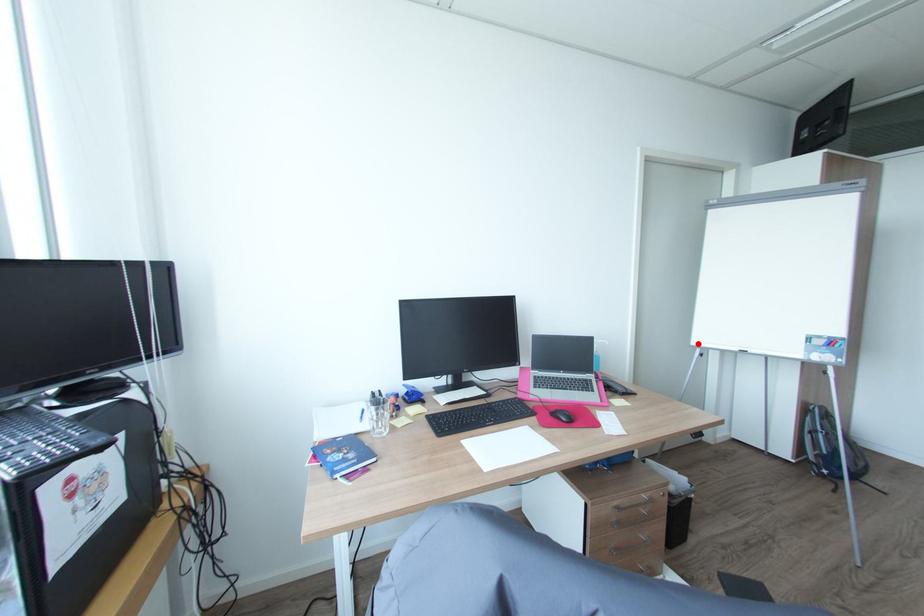
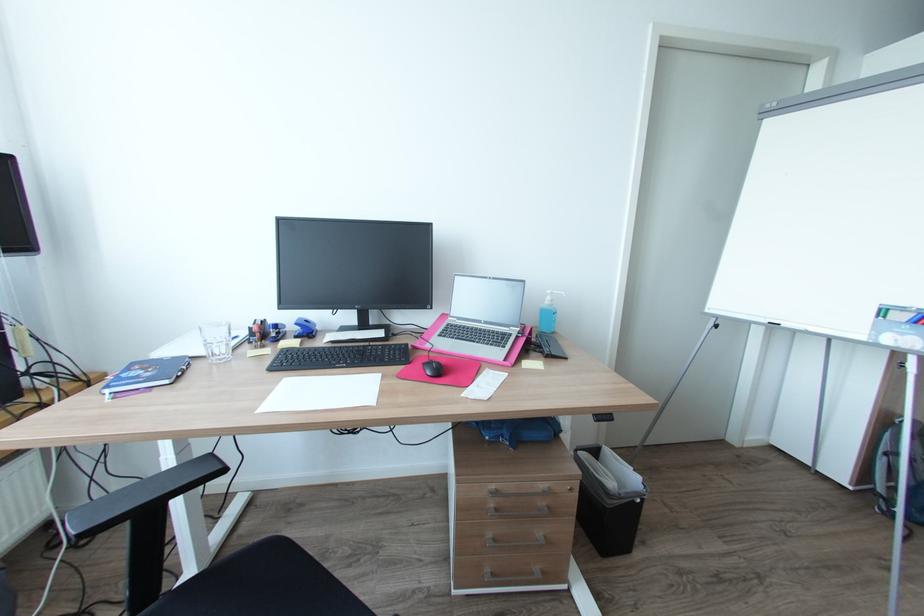
Where in the second image is the point corresponding to the highlighted location from the first image?

(712, 310)